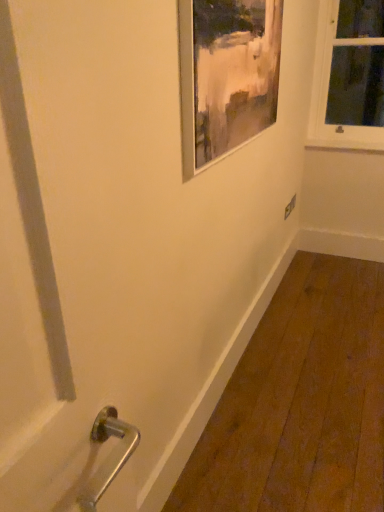
Question: From a real-world perspective, is white wooden window at upper right physically below white matte window sill at upper right?

Choices:
 (A) yes
 (B) no

Answer: (B)

Question: Can you confirm if white wooden window at upper right is wider than white matte window sill at upper right?

Choices:
 (A) no
 (B) yes

Answer: (B)

Question: Is white wooden window at upper right completely or partially outside of white matte window sill at upper right?

Choices:
 (A) no
 (B) yes

Answer: (B)

Question: Can you confirm if white wooden window at upper right is shorter than white matte window sill at upper right?

Choices:
 (A) yes
 (B) no

Answer: (B)

Question: Is the surface of white wooden window at upper right in direct contact with white matte window sill at upper right?

Choices:
 (A) yes
 (B) no

Answer: (B)

Question: Is white wooden window at upper right spatially inside metallic silver picture frame at upper center, or outside of it?

Choices:
 (A) outside
 (B) inside

Answer: (A)

Question: Considering their positions, is white wooden window at upper right located in front of or behind metallic silver picture frame at upper center?

Choices:
 (A) front
 (B) behind

Answer: (B)

Question: In terms of width, does white wooden window at upper right look wider or thinner when compared to metallic silver picture frame at upper center?

Choices:
 (A) thin
 (B) wide

Answer: (B)

Question: Based on their positions, is white wooden window at upper right located to the left or right of metallic silver picture frame at upper center?

Choices:
 (A) left
 (B) right

Answer: (B)

Question: Is white wooden window at upper right wider or thinner than white matte window sill at upper right?

Choices:
 (A) wide
 (B) thin

Answer: (A)

Question: Is white wooden window at upper right taller or shorter than white matte window sill at upper right?

Choices:
 (A) tall
 (B) short

Answer: (A)

Question: From the image's perspective, is white wooden window at upper right above or below white matte window sill at upper right?

Choices:
 (A) above
 (B) below

Answer: (A)

Question: Is white wooden window at upper right inside the boundaries of white matte window sill at upper right, or outside?

Choices:
 (A) outside
 (B) inside

Answer: (A)

Question: From a real-world perspective, is white matte window sill at upper right positioned above or below white wooden window at upper right?

Choices:
 (A) above
 (B) below

Answer: (B)

Question: From the image's perspective, relative to white wooden window at upper right, is white matte window sill at upper right above or below?

Choices:
 (A) above
 (B) below

Answer: (B)